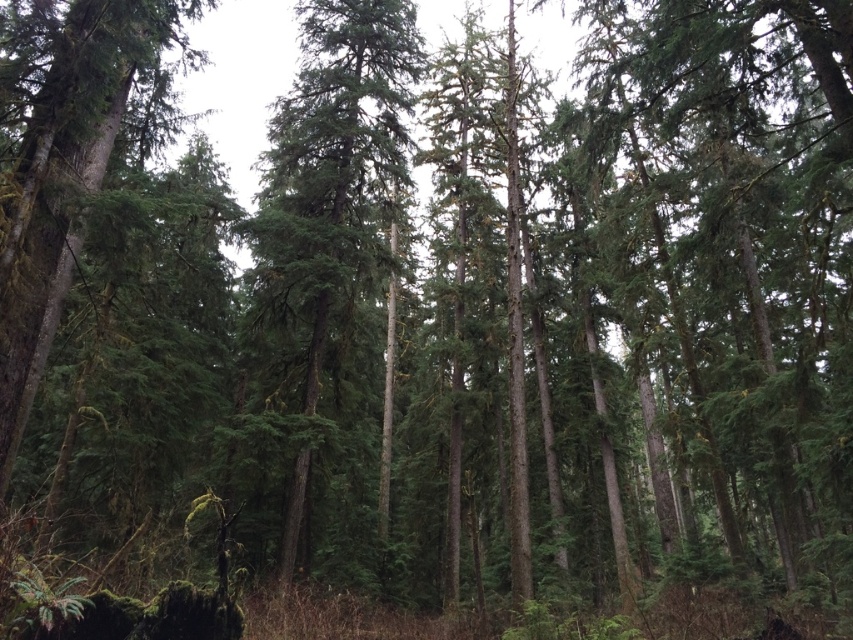
Who is taller, green needle-like at center or green matte tree at left?

green needle-like at center

Does green needle-like at center appear on the left side of green matte tree at left?

In fact, green needle-like at center is to the right of green matte tree at left.

Which is behind, point (328, 307) or point (80, 44)?

The point (328, 307) is more distant.

The width and height of the screenshot is (853, 640). Identify the location of green needle-like at center. (331, 195).